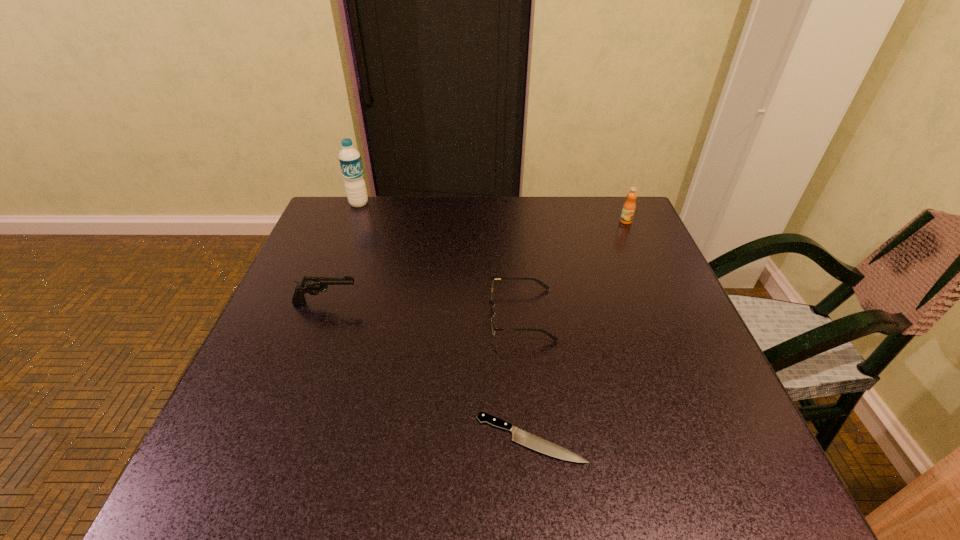
Where is `object situated at the right edge`? The height and width of the screenshot is (540, 960). object situated at the right edge is located at coordinates (629, 206).

The image size is (960, 540). What are the coordinates of `object that is at the far left corner` in the screenshot? It's located at (350, 161).

I want to click on object at the far right corner, so click(x=629, y=206).

Image resolution: width=960 pixels, height=540 pixels. What are the coordinates of `free space at the far edge of the desktop` in the screenshot? It's located at (407, 205).

This screenshot has height=540, width=960. I want to click on free space at the near edge, so click(512, 448).

At what (x,y) coordinates should I click in order to perform the action: click on vacant point at the left edge. Please return your answer as a coordinate pair (x, y). The width and height of the screenshot is (960, 540). Looking at the image, I should click on (x=301, y=276).

You are a GUI agent. You are given a task and a screenshot of the screen. Output one action in this format:
    pyautogui.click(x=<x>, y=<y>)
    Task: Click on the free region at the right edge of the desktop
    This screenshot has height=540, width=960.
    Given the screenshot: What is the action you would take?
    pyautogui.click(x=622, y=255)

At what (x,y) coordinates should I click in order to perform the action: click on free spot at the far left corner of the desktop. Please return your answer as a coordinate pair (x, y). Image resolution: width=960 pixels, height=540 pixels. Looking at the image, I should click on (362, 212).

This screenshot has width=960, height=540. In the image, there is a desktop. Identify the location of vacant area at the far right corner. (609, 212).

In order to click on free spot between the fourth tallest object and the steak knife in this screenshot , I will do `click(526, 376)`.